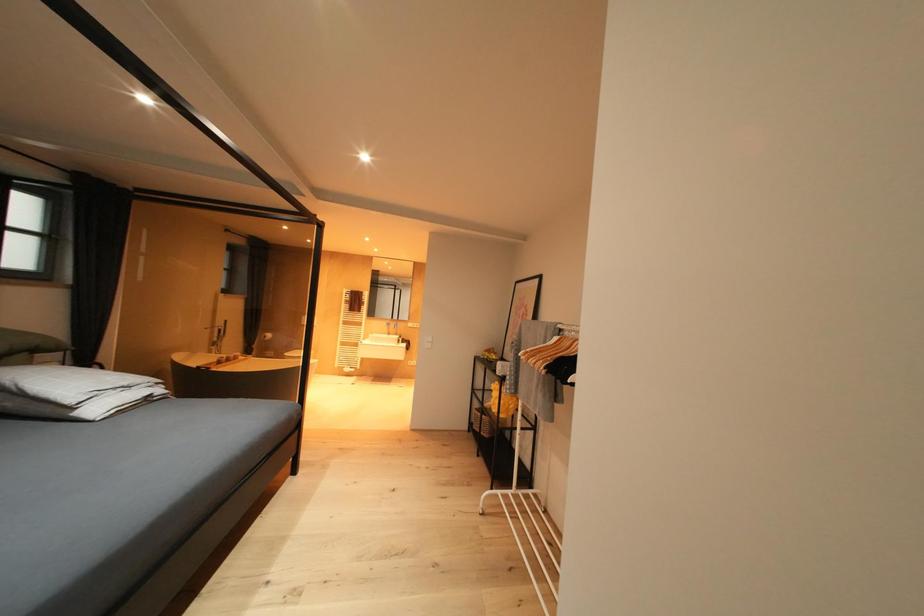
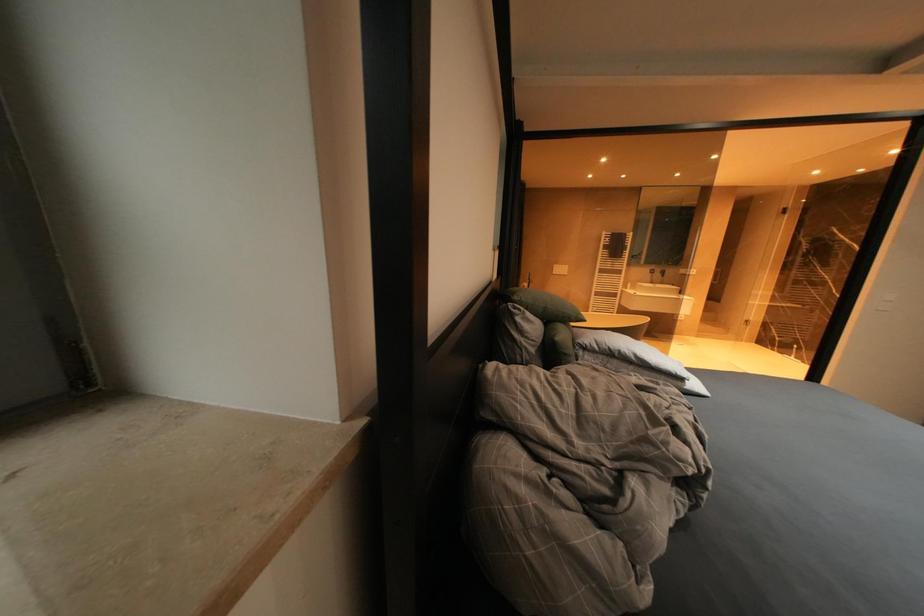
Question: In a continuous first-person perspective shot, in which direction is the camera moving?

Choices:
 (A) Left
 (B) Right
 (C) Forward
 (D) Backward

Answer: (A)